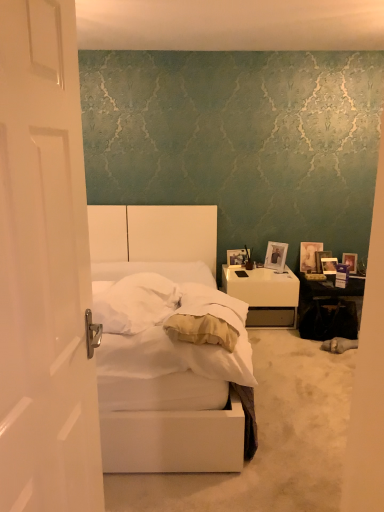
Question: Can you confirm if matte purple picture frame at right, acting as the first picture frame starting from the right, is bigger than matte silver picture frame at upper right, the 4th picture frame from the right?

Choices:
 (A) yes
 (B) no

Answer: (B)

Question: Can you confirm if matte purple picture frame at right, which is the 5th picture frame in left-to-right order, is thinner than matte silver picture frame at upper right, the 4th picture frame from the right?

Choices:
 (A) yes
 (B) no

Answer: (A)

Question: Can you confirm if matte purple picture frame at right, which is the 5th picture frame in left-to-right order, is shorter than matte silver picture frame at upper right, the 4th picture frame from the right?

Choices:
 (A) no
 (B) yes

Answer: (B)

Question: Is matte purple picture frame at right, acting as the first picture frame starting from the right, far away from matte silver picture frame at upper right, arranged as the second picture frame when viewed from the left?

Choices:
 (A) yes
 (B) no

Answer: (B)

Question: Considering the relative sizes of matte purple picture frame at right, acting as the first picture frame starting from the right, and matte silver picture frame at upper right, the 4th picture frame from the right, in the image provided, is matte purple picture frame at right, acting as the first picture frame starting from the right, wider than matte silver picture frame at upper right, the 4th picture frame from the right,?

Choices:
 (A) no
 (B) yes

Answer: (A)

Question: From a real-world perspective, does matte purple picture frame at right, which is the 5th picture frame in left-to-right order, sit lower than matte silver picture frame at upper right, the 4th picture frame from the right?

Choices:
 (A) no
 (B) yes

Answer: (B)

Question: Is metallic silver picture frame at upper right, which is the 4th picture frame in left-to-right order, outside of wooden photo frame at right, acting as the 1th picture frame starting from the left?

Choices:
 (A) no
 (B) yes

Answer: (B)

Question: Is metallic silver picture frame at upper right, positioned as the 2th picture frame in right-to-left order, at the left side of wooden photo frame at right, marked as the 5th picture frame in a right-to-left arrangement?

Choices:
 (A) no
 (B) yes

Answer: (A)

Question: Considering the relative positions of metallic silver picture frame at upper right, positioned as the 2th picture frame in right-to-left order, and wooden photo frame at right, acting as the 1th picture frame starting from the left, in the image provided, is metallic silver picture frame at upper right, positioned as the 2th picture frame in right-to-left order, behind wooden photo frame at right, acting as the 1th picture frame starting from the left,?

Choices:
 (A) no
 (B) yes

Answer: (B)

Question: Is metallic silver picture frame at upper right, positioned as the 2th picture frame in right-to-left order, thinner than wooden photo frame at right, acting as the 1th picture frame starting from the left?

Choices:
 (A) no
 (B) yes

Answer: (A)

Question: Does metallic silver picture frame at upper right, positioned as the 2th picture frame in right-to-left order, contain wooden photo frame at right, marked as the 5th picture frame in a right-to-left arrangement?

Choices:
 (A) no
 (B) yes

Answer: (A)

Question: Could you tell me if metallic silver picture frame at upper right, which is the 4th picture frame in left-to-right order, is turned towards wooden photo frame at right, acting as the 1th picture frame starting from the left?

Choices:
 (A) no
 (B) yes

Answer: (A)

Question: Is wooden photo frame at right, marked as the 5th picture frame in a right-to-left arrangement, positioned with its back to metallic silver picture frame at upper right, which is the 4th picture frame in left-to-right order?

Choices:
 (A) no
 (B) yes

Answer: (A)